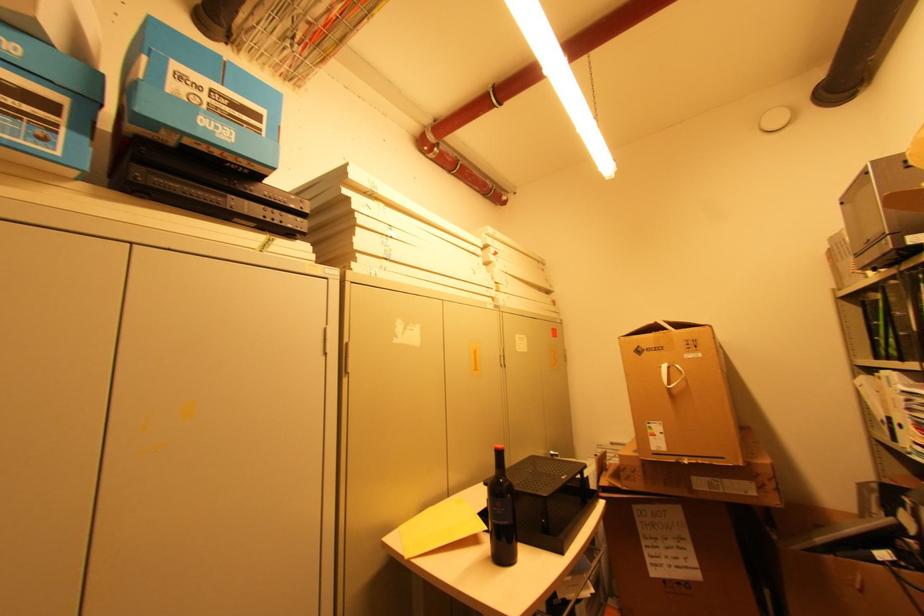
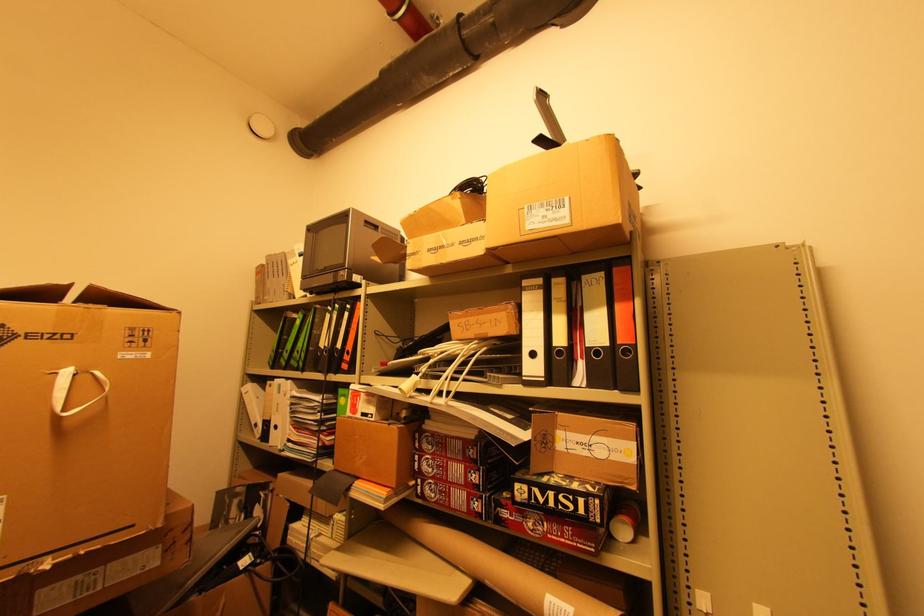
Locate, in the second image, the point that corresponds to the point at 663,349 in the first image.

(70, 338)